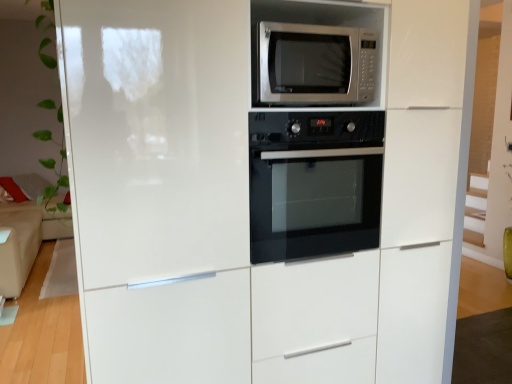
The height and width of the screenshot is (384, 512). Describe the element at coordinates (314, 64) in the screenshot. I see `satin silver microwave at upper center` at that location.

In order to click on black glass oven at center in this screenshot , I will do `click(314, 183)`.

The width and height of the screenshot is (512, 384). Describe the element at coordinates (26, 232) in the screenshot. I see `beige fabric couch at left` at that location.

Identify the location of satin silver microwave at upper center. (314, 64).

Is beige fabric couch at left situated inside satin silver microwave at upper center or outside?

beige fabric couch at left is located beyond the bounds of satin silver microwave at upper center.

Is beige fabric couch at left oriented towards satin silver microwave at upper center?

No.

Find the location of a particular element. microwave oven positioned vertically above the beige fabric couch at left (from a real-world perspective) is located at coordinates (314, 64).

From a real-world perspective, relative to satin silver microwave at upper center, is beige fabric couch at left vertically above or below?

beige fabric couch at left is below satin silver microwave at upper center.

From the image's perspective, between black glass oven at center and beige fabric couch at left, who is located below?

beige fabric couch at left, from the image's perspective.

From a real-world perspective, is black glass oven at center positioned under beige fabric couch at left based on gravity?

No, from a real-world perspective, black glass oven at center is not below beige fabric couch at left.

Considering the points (329, 240) and (49, 226), which point is behind, point (329, 240) or point (49, 226)?

The point (49, 226) is more distant.

The height and width of the screenshot is (384, 512). Identify the location of oven on the right of beige fabric couch at left. (314, 183).

The image size is (512, 384). Find the location of `microwave oven on the left of black glass oven at center`. microwave oven on the left of black glass oven at center is located at coordinates (314, 64).

Considering the positions of objects satin silver microwave at upper center and black glass oven at center in the image provided, who is behind, satin silver microwave at upper center or black glass oven at center?

Positioned behind is black glass oven at center.

This screenshot has width=512, height=384. Find the location of `oven on the right side of satin silver microwave at upper center`. oven on the right side of satin silver microwave at upper center is located at coordinates (314, 183).

From a real-world perspective, does black glass oven at center stand above satin silver microwave at upper center?

Incorrect, from a real-world perspective, black glass oven at center is lower than satin silver microwave at upper center.

Which of these two, black glass oven at center or satin silver microwave at upper center, is smaller?

satin silver microwave at upper center.

Would you say black glass oven at center is a long distance from satin silver microwave at upper center?

black glass oven at center is near satin silver microwave at upper center, not far away.

Can you confirm if beige fabric couch at left is wider than black glass oven at center?

Correct, the width of beige fabric couch at left exceeds that of black glass oven at center.

Can you confirm if beige fabric couch at left is positioned to the left of black glass oven at center?

Correct, you'll find beige fabric couch at left to the left of black glass oven at center.

In the image, is beige fabric couch at left positioned in front of or behind black glass oven at center?

In the image, beige fabric couch at left appears behind black glass oven at center.

Does beige fabric couch at left touch black glass oven at center?

beige fabric couch at left and black glass oven at center are not in contact.

Is satin silver microwave at upper center completely or partially outside of beige fabric couch at left?

That's correct, satin silver microwave at upper center is outside of beige fabric couch at left.

Looking at this image, is satin silver microwave at upper center far away from beige fabric couch at left?

Yes, satin silver microwave at upper center and beige fabric couch at left are quite far apart.

From a real-world perspective, is satin silver microwave at upper center physically located above or below beige fabric couch at left?

satin silver microwave at upper center is above beige fabric couch at left.

Does satin silver microwave at upper center appear on the left side of beige fabric couch at left?

In fact, satin silver microwave at upper center is to the right of beige fabric couch at left.

I want to click on microwave oven that appears above the beige fabric couch at left (from the image's perspective), so click(314, 64).

Find the location of a particular element. This screenshot has height=384, width=512. oven on the right side of beige fabric couch at left is located at coordinates (314, 183).

Estimate the real-world distances between objects in this image. Which object is closer to black glass oven at center, beige fabric couch at left or satin silver microwave at upper center?

satin silver microwave at upper center lies closer to black glass oven at center than the other object.

Based on the photo, estimate the real-world distances between objects in this image. Which object is further from beige fabric couch at left, black glass oven at center or satin silver microwave at upper center?

satin silver microwave at upper center.

From the image, which object appears to be nearer to beige fabric couch at left, satin silver microwave at upper center or black glass oven at center?

black glass oven at center.

From the picture: Estimate the real-world distances between objects in this image. Which object is further from satin silver microwave at upper center, beige fabric couch at left or black glass oven at center?

Based on the image, beige fabric couch at left appears to be further to satin silver microwave at upper center.

Which object lies further to the anchor point satin silver microwave at upper center, black glass oven at center or beige fabric couch at left?

beige fabric couch at left is further to satin silver microwave at upper center.

Considering their positions, is satin silver microwave at upper center positioned closer to black glass oven at center than beige fabric couch at left?

Based on the image, satin silver microwave at upper center appears to be nearer to black glass oven at center.

You are a GUI agent. You are given a task and a screenshot of the screen. Output one action in this format:
    pyautogui.click(x=<x>, y=<y>)
    Task: Click on the microwave oven between beige fabric couch at left and black glass oven at center from left to right
    
    Given the screenshot: What is the action you would take?
    pyautogui.click(x=314, y=64)